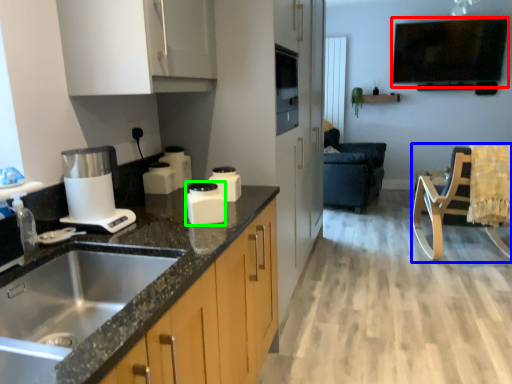
Question: Considering the real-world distances, which object is farthest from window screen (highlighted by a red box)? rocking chair (highlighted by a blue box) or kitchen appliance (highlighted by a green box)?

Choices:
 (A) rocking chair
 (B) kitchen appliance

Answer: (B)